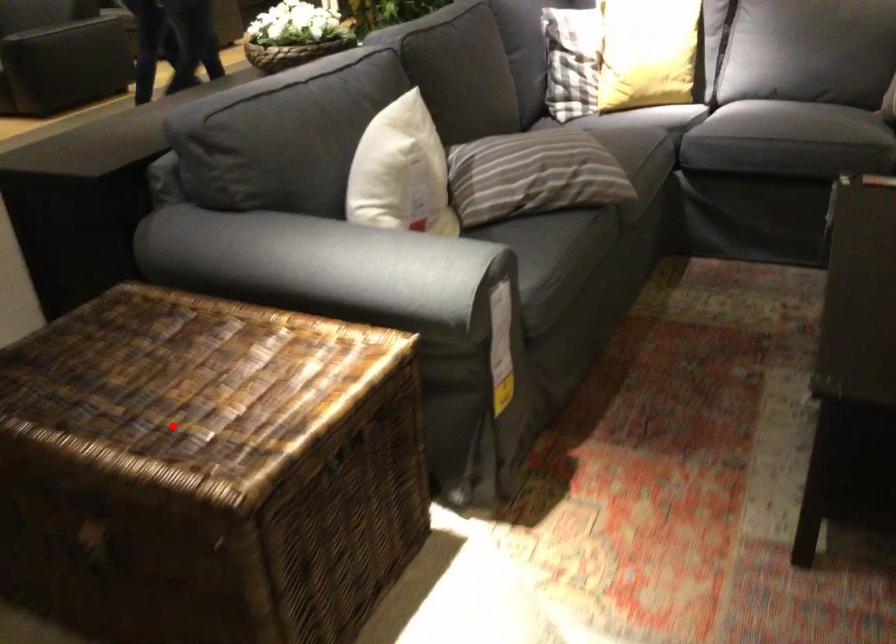
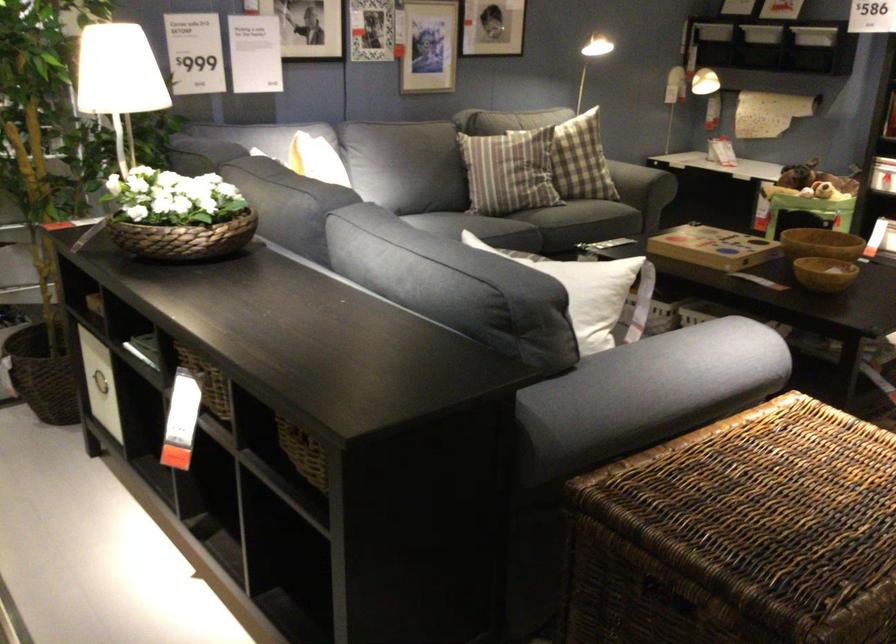
Where in the second image is the point corresponding to the highlighted location from the first image?

(776, 509)